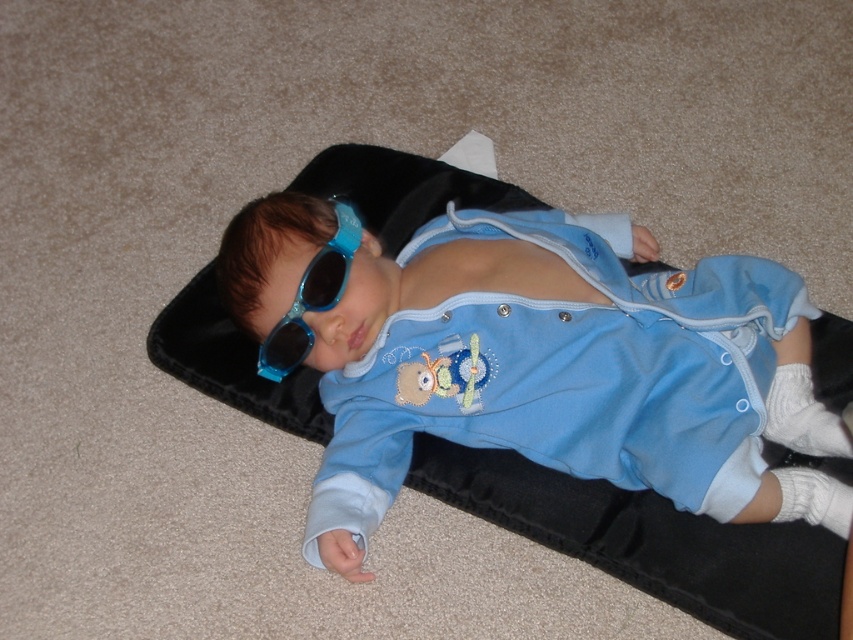
Please describe the position of the baby in the image using the coordinates provided. What is located at point (x=532, y=358)?

The point (x=532, y=358) corresponds to the blue soft fabric baby at center.

You are a photographer setting up a shoot for a baby clothing catalog. You have a blue soft fabric baby at center and blue shiny sunglasses at center in the scene. The baby needs to be photographed with the sunglasses. Based on their positions, can you place the sunglasses on the baby without moving the baby?

The blue soft fabric baby at center is positioned on the right side of the blue shiny sunglasses at center. Since the sunglasses are already to the left of the baby, you can easily slide them onto the baby without needing to move the baby.

You are a photographer trying to capture the baby in the image without moving any objects. Since the blue shiny sunglasses at center might block the baby blue soft fabric baby at center, will the sunglasses be visible in the photo?

The blue soft fabric baby at center is in front of the blue shiny sunglasses at center, so the sunglasses will be blocked by the baby and not visible in the photo.